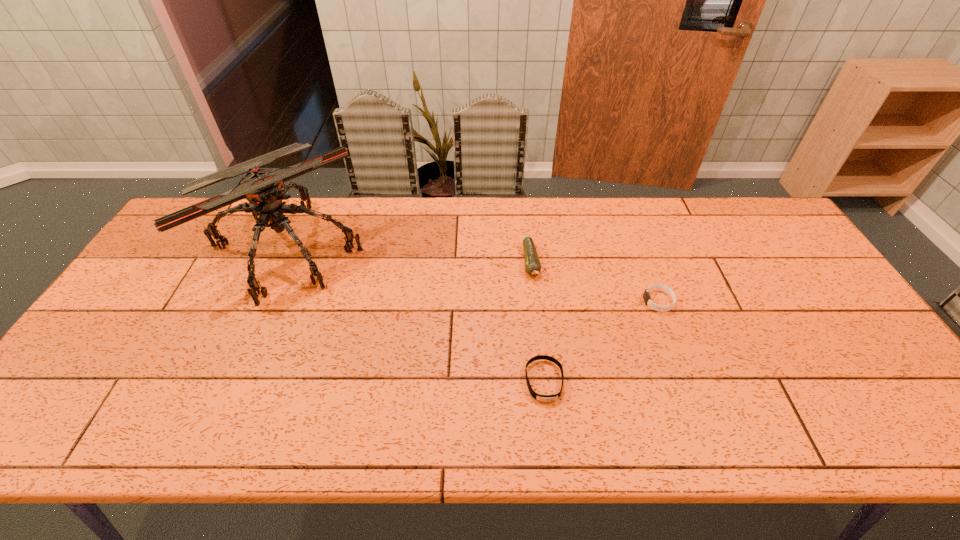
Identify the location of vacant region located on the outer surface of the third tallest object. This screenshot has height=540, width=960. (511, 301).

Identify the location of vacant area situated 0.290m on the outer surface of the third tallest object. This screenshot has height=540, width=960. (540, 301).

Where is `blank space located on the display of the left wristband`? Image resolution: width=960 pixels, height=540 pixels. blank space located on the display of the left wristband is located at coordinates (552, 447).

Locate an element on the screen. drone at the far edge is located at coordinates (264, 189).

At what (x,y) coordinates should I click in order to perform the action: click on zucchini that is positioned at the far edge. Please return your answer as a coordinate pair (x, y). The height and width of the screenshot is (540, 960). Looking at the image, I should click on click(x=532, y=263).

Locate an element on the screen. object situated at the left edge is located at coordinates [x=264, y=189].

The width and height of the screenshot is (960, 540). I want to click on object located at the far left corner, so click(264, 189).

Locate an element on the screen. vacant space at the far edge of the desktop is located at coordinates (335, 231).

At what (x,y) coordinates should I click in order to perform the action: click on free region at the near edge of the desktop. Please return your answer as a coordinate pair (x, y). Looking at the image, I should click on (389, 428).

At what (x,y) coordinates should I click in order to perform the action: click on vacant region at the left edge of the desktop. Please return your answer as a coordinate pair (x, y). The image size is (960, 540). Looking at the image, I should click on (88, 354).